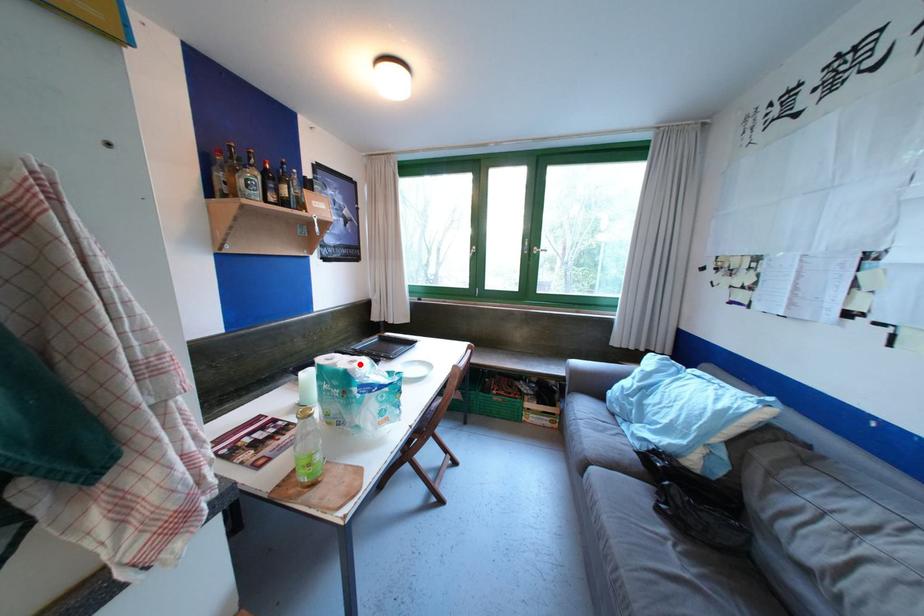
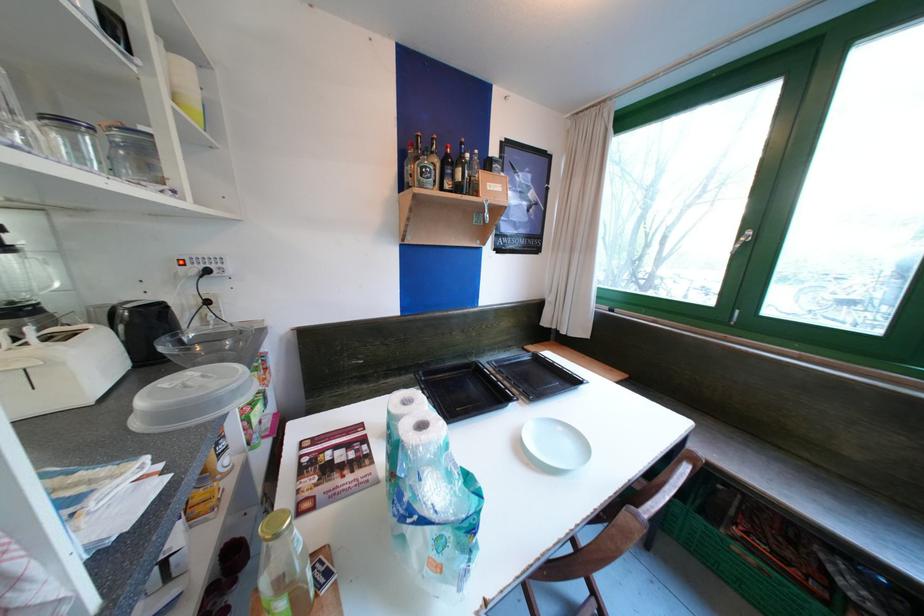
Question: A red point is marked in image1. In image2, is the corresponding 3D point closer to the camera or farther? Reply with the corresponding letter.

Choices:
 (A) The corresponding 3D point is closer.
 (B) The corresponding 3D point is farther.

Answer: (B)